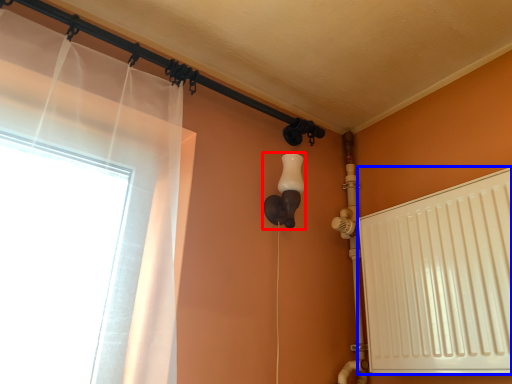
Question: Which object is closer to the camera taking this photo, light fixture (highlighted by a red box) or radiator (highlighted by a blue box)?

Choices:
 (A) light fixture
 (B) radiator

Answer: (B)